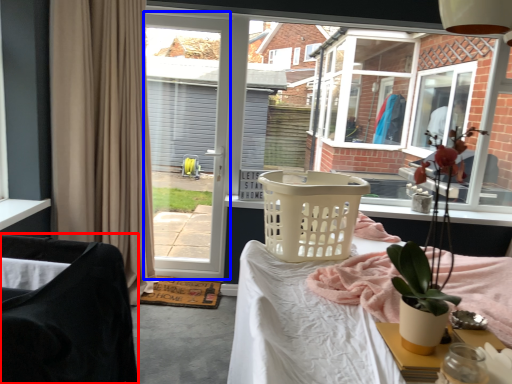
Question: Which object is further to the camera taking this photo, chair (highlighted by a red box) or screen door (highlighted by a blue box)?

Choices:
 (A) chair
 (B) screen door

Answer: (B)